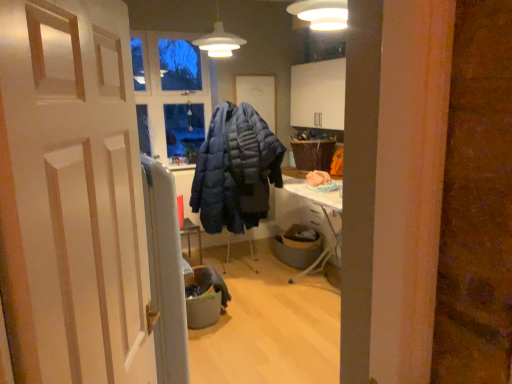
Question: Would you say gray fabric trash bin at center, marked as the second trash bin/can in a front-to-back arrangement, is inside or outside white wooden door at center?

Choices:
 (A) outside
 (B) inside

Answer: (A)

Question: In the image, is gray fabric trash bin at center, placed as the 2th trash bin/can when sorted from left to right, positioned in front of or behind white wooden door at center?

Choices:
 (A) front
 (B) behind

Answer: (B)

Question: Which object is the farthest from the gray fabric trash bin at center, placed as the 2th trash bin/can when sorted from right to left?

Choices:
 (A) woven brown picnic basket at upper right
 (B) matte white pendant light at upper center
 (C) matte blue puffer jacket at center
 (D) white wooden door at center
 (E) gray fabric trash bin at center, marked as the second trash bin/can in a front-to-back arrangement

Answer: (D)

Question: Which of these objects is positioned farthest from the white wooden door at center?

Choices:
 (A) matte blue puffer jacket at center
 (B) gray fabric trash bin at center, placed as the 2th trash bin/can when sorted from left to right
 (C) woven brown picnic basket at upper right
 (D) matte white pendant light at upper center
 (E) gray fabric trash bin at center, the first trash bin/can in the left-to-right sequence

Answer: (C)